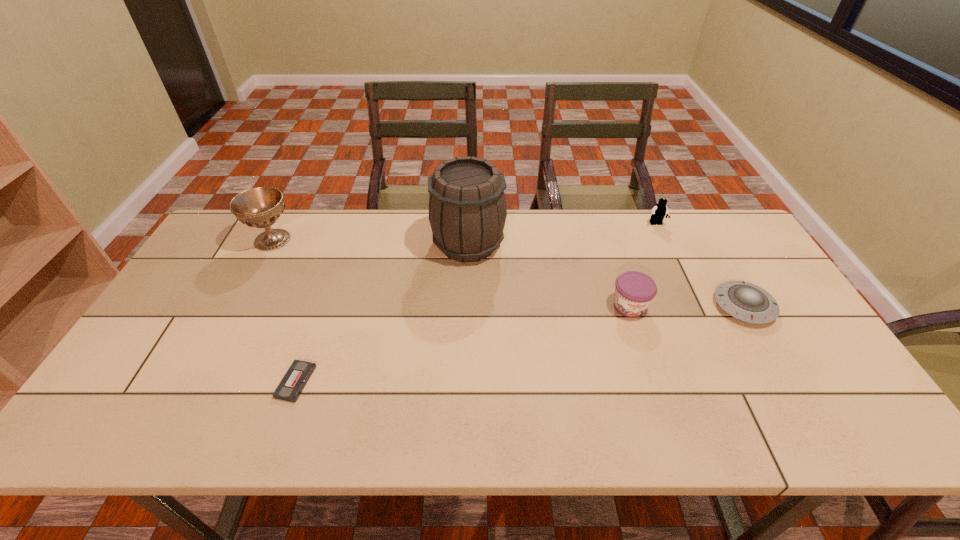
You are a GUI agent. You are given a task and a screenshot of the screen. Output one action in this format:
    pyautogui.click(x=<x>, y=<y>)
    Task: Click on the free space between the tallest object and the saucer
    The image size is (960, 540).
    Given the screenshot: What is the action you would take?
    pyautogui.click(x=606, y=275)

Identify the location of blank region between the second object from right to left and the saucer. (700, 265).

Where is `free space between the nearest object and the chalice`? The image size is (960, 540). free space between the nearest object and the chalice is located at coordinates (284, 311).

Locate an element on the screen. free space between the rightmost object and the Lego is located at coordinates (700, 265).

Identify the location of free point between the fifth object from right to left and the fourth object from left to right. (463, 344).

Locate an element on the screen. The image size is (960, 540). vacant region between the second object from right to left and the shortest object is located at coordinates (476, 303).

Where is `vacant area that lies between the fourth object from left to right and the rightmost object`? The height and width of the screenshot is (540, 960). vacant area that lies between the fourth object from left to right and the rightmost object is located at coordinates (686, 306).

Where is `object that ranks as the fourth closest to the chalice`? object that ranks as the fourth closest to the chalice is located at coordinates (660, 210).

Find the location of a particular element. This screenshot has width=960, height=540. object that stands as the fourth closest to the chalice is located at coordinates (660, 210).